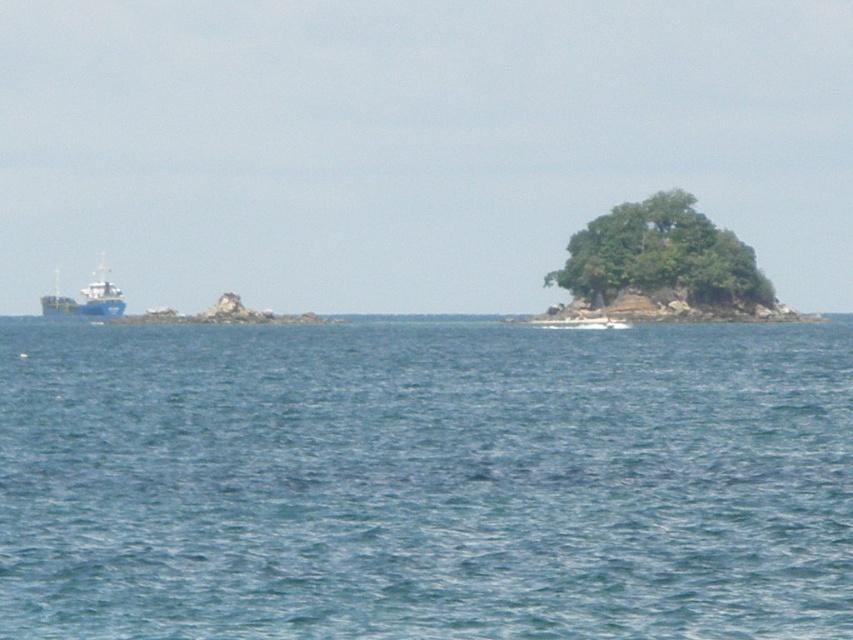
Is point (206, 330) positioned before point (102, 316)?

Yes, point (206, 330) is in front of point (102, 316).

Does point (198, 438) come in front of point (80, 310)?

That is True.

The height and width of the screenshot is (640, 853). Find the location of `blue water at center`. blue water at center is located at coordinates (425, 481).

Can you confirm if blue water at center is wider than green leafy island at center?

Indeed, blue water at center has a greater width compared to green leafy island at center.

Between blue water at center and green leafy island at center, which one is positioned lower?

blue water at center

Is point (569, 352) positioned after point (630, 244)?

No, it is not.

Where is `blue water at center`? Image resolution: width=853 pixels, height=640 pixels. blue water at center is located at coordinates (425, 481).

Which is above, green leafy island at center or blue matte boat at left?

green leafy island at center is higher up.

Is green leafy island at center smaller than blue matte boat at left?

Yes.

Consider the image. Measure the distance between green leafy island at center and camera.

green leafy island at center is 132.15 meters away from camera.

At what (x,y) coordinates should I click in order to perform the action: click on green leafy island at center. Please return your answer as a coordinate pair (x, y). Image resolution: width=853 pixels, height=640 pixels. Looking at the image, I should click on (660, 257).